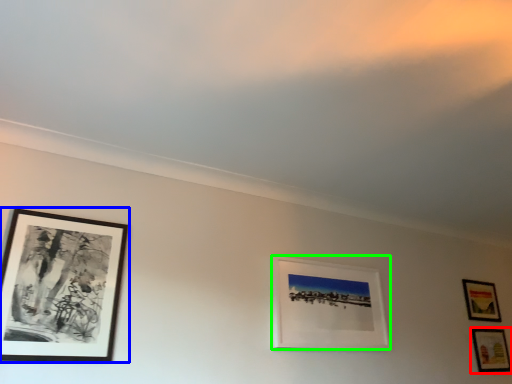
Question: Considering the real-world distances, which object is farthest from picture frame (highlighted by a red box)? picture frame (highlighted by a blue box) or picture frame (highlighted by a green box)?

Choices:
 (A) picture frame
 (B) picture frame

Answer: (A)